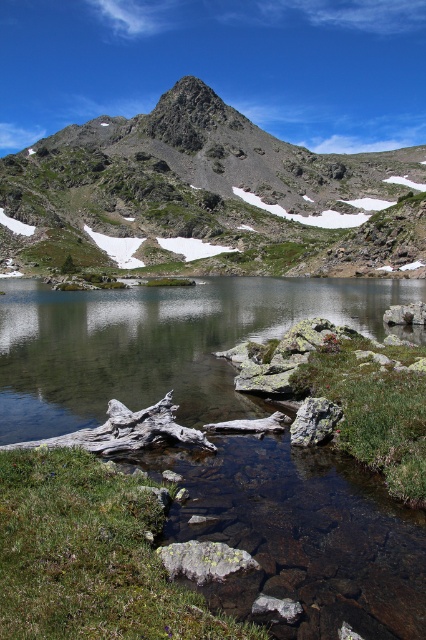
What do you see at coordinates (204, 561) in the screenshot?
I see `gray rock at lower center` at bounding box center [204, 561].

Which is behind, point (193, 573) or point (391, 310)?

Point (391, 310)

Identify the location of gray rock at lower center. The height and width of the screenshot is (640, 426). (204, 561).

Does gray rough rock at lower center have a greater height compared to gray rock at center?

Yes.

Does point (322, 403) come behind point (397, 307)?

No, (322, 403) is in front of (397, 307).

Locate an element on the screen. gray rough rock at lower center is located at coordinates (313, 420).

Between rocky gray mountain at upper center and gray rough rock at lower center, which one appears on the right side from the viewer's perspective?

Positioned to the right is rocky gray mountain at upper center.

Is point (273, 236) closer to camera compared to point (291, 422)?

No, it is behind (291, 422).

Does point (180, 124) lie in front of point (324, 426)?

No.

Locate an element on the screen. This screenshot has height=640, width=426. rocky gray mountain at upper center is located at coordinates (209, 195).